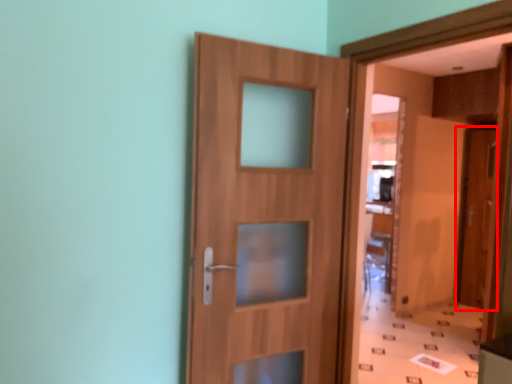
Question: Observing the image, what is the correct spatial positioning of door (annotated by the red box) in reference to door?

Choices:
 (A) left
 (B) right

Answer: (B)